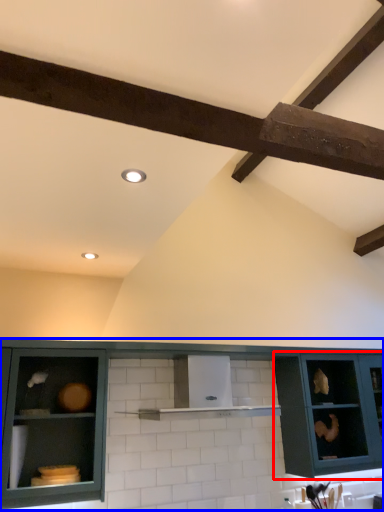
Question: Which of the following is the closest to the observer, cabinetry (highlighted by a red box) or cabinetry (highlighted by a blue box)?

Choices:
 (A) cabinetry
 (B) cabinetry

Answer: (B)